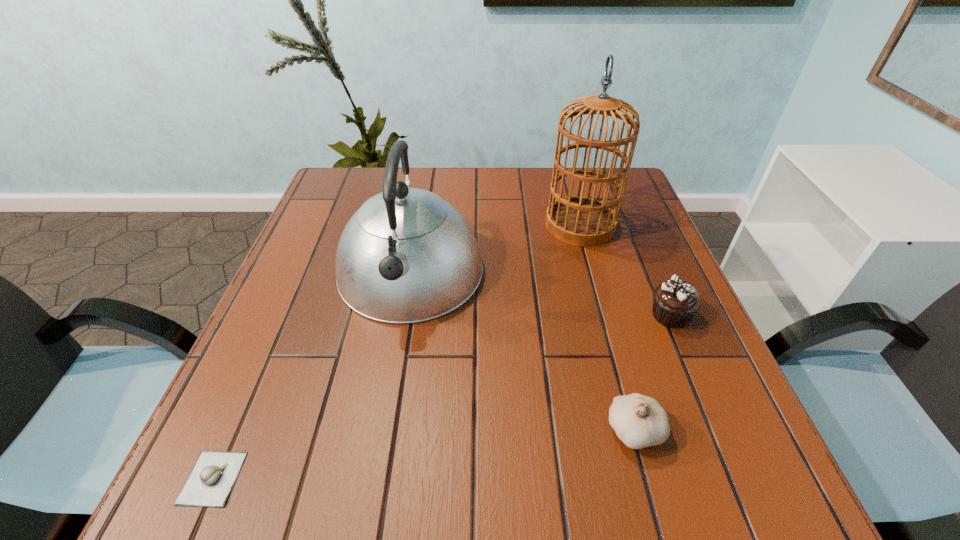
Where is `free space in the image that satisfies the following two spatial constraints: 1. from the spout of the taller garlic; 2. on the left side of the fourth shortest object`? The height and width of the screenshot is (540, 960). free space in the image that satisfies the following two spatial constraints: 1. from the spout of the taller garlic; 2. on the left side of the fourth shortest object is located at coordinates (383, 430).

You are a GUI agent. You are given a task and a screenshot of the screen. Output one action in this format:
    pyautogui.click(x=<x>, y=<y>)
    Task: Click on the vacant space that satisfies the following two spatial constraints: 1. from the spout of the taller garlic; 2. on the left side of the fourth object from right to left
    
    Given the screenshot: What is the action you would take?
    pyautogui.click(x=383, y=430)

Where is `free space that satisfies the following two spatial constraints: 1. on the back side of the right garlic; 2. on the right side of the rightmost object`? The image size is (960, 540). free space that satisfies the following two spatial constraints: 1. on the back side of the right garlic; 2. on the right side of the rightmost object is located at coordinates (603, 315).